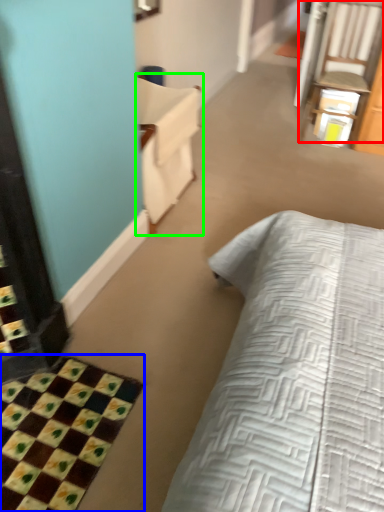
Question: Which is nearer to the chair (highlighted by a red box)? bath mat (highlighted by a blue box) or armchair (highlighted by a green box).

Choices:
 (A) bath mat
 (B) armchair

Answer: (B)